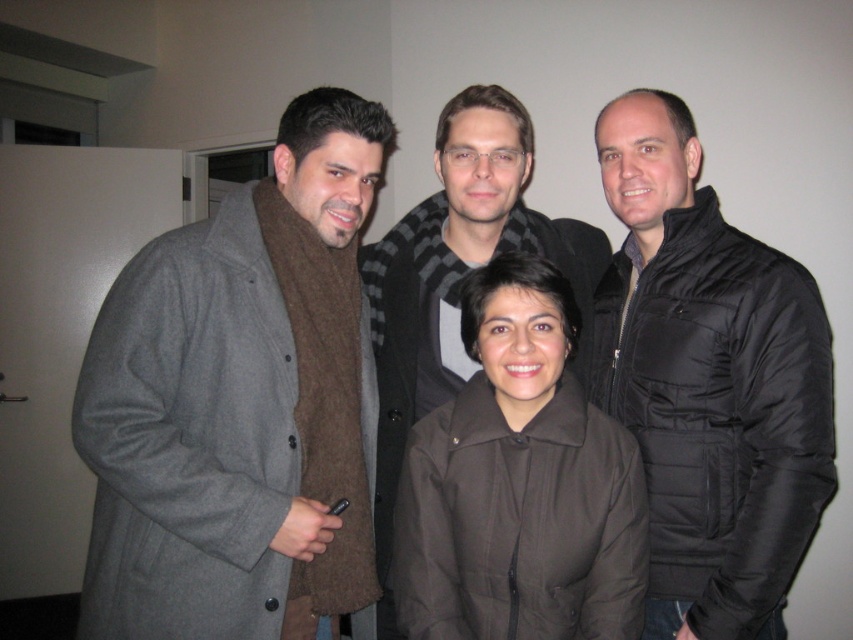
Based on the photo, based on the scene description, where is the gray wool coat at left located in relation to the point at coordinates (239, 403)?

The gray wool coat at left is located at the point with coordinates (239, 403).

You are a photographer setting up for a group photo. You need to ensure there is enough space between the gray wool coat at left and the black quilted jacket at right for a camera tripod. The tripod requires at least 24 inches of space between the two subjects. Based on the scene, can you fit the tripod between them?

The gray wool coat at left is 22.97 inches away from the black quilted jacket at right. Since the required space for the tripod is 24 inches, the distance is insufficient. The tripod cannot be placed between them.

You are organizing a clothing rack and need to arrange the gray wool coat at left and the brown matte jacket at center based on their positions in the image. Which should be placed on the left side of the rack?

The gray wool coat at left should be placed on the left side of the rack since it is positioned on the left side of the brown matte jacket at center in the image.